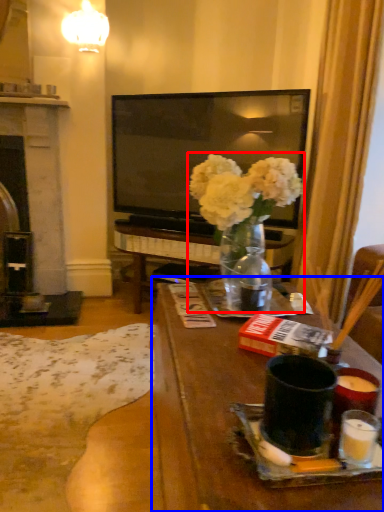
Question: Among these objects, which one is farthest to the camera, floral arrangement (highlighted by a red box) or table (highlighted by a blue box)?

Choices:
 (A) floral arrangement
 (B) table

Answer: (A)